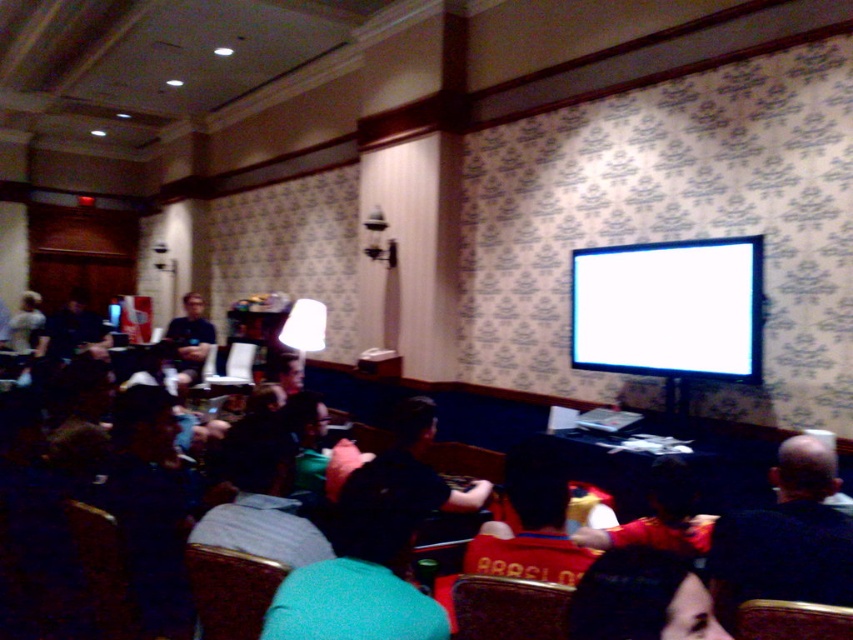
You are standing at the entrance of the conference room and need to sit in the brown leather chair at lower right. Which direction should you walk to reach it?

The brown leather chair at lower right is located at point (791, 620), which is in the lower right corner of the room. To reach it, walk towards the lower right direction from the entrance.

You are sitting in the brown leather chair at lower right and want to look at the white glossy monitor at upper right. Can you see it without moving your chair?

The brown leather chair at lower right is behind the white glossy monitor at upper right, so you can see it without moving your chair.